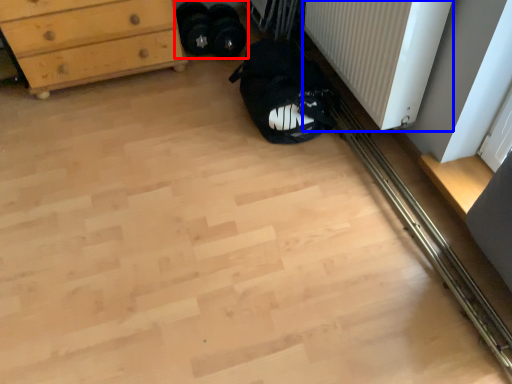
Question: Which point is further to the camera, footwear (highlighted by a red box) or radiator (highlighted by a blue box)?

Choices:
 (A) footwear
 (B) radiator

Answer: (A)